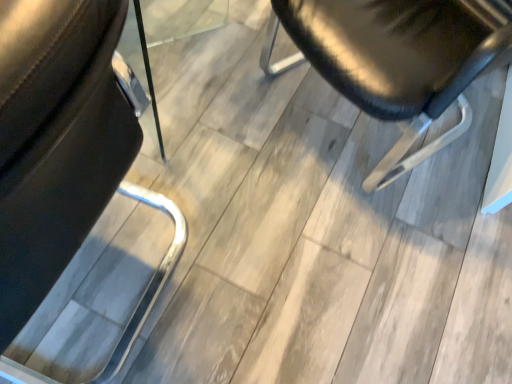
Question: Which direction should I rotate to look at shiny black chair at center, which appears as the first chair when viewed from the right?

Choices:
 (A) right
 (B) left

Answer: (A)

Question: Is black leather chair at left, placed as the 1th chair when sorted from left to right, aimed at shiny black chair at center, which is counted as the second chair, starting from the left?

Choices:
 (A) yes
 (B) no

Answer: (B)

Question: From a real-world perspective, does black leather chair at left, arranged as the second chair when viewed from the right, sit lower than shiny black chair at center, which is counted as the second chair, starting from the left?

Choices:
 (A) no
 (B) yes

Answer: (A)

Question: Does black leather chair at left, arranged as the second chair when viewed from the right, lie in front of shiny black chair at center, which appears as the first chair when viewed from the right?

Choices:
 (A) no
 (B) yes

Answer: (B)

Question: Does black leather chair at left, placed as the 1th chair when sorted from left to right, have a lesser width compared to shiny black chair at center, which appears as the first chair when viewed from the right?

Choices:
 (A) yes
 (B) no

Answer: (A)

Question: Considering the relative sizes of black leather chair at left, placed as the 1th chair when sorted from left to right, and shiny black chair at center, which is counted as the second chair, starting from the left, in the image provided, is black leather chair at left, placed as the 1th chair when sorted from left to right, bigger than shiny black chair at center, which is counted as the second chair, starting from the left,?

Choices:
 (A) no
 (B) yes

Answer: (B)

Question: From the image's perspective, is black leather chair at left, arranged as the second chair when viewed from the right, beneath shiny black chair at center, which is counted as the second chair, starting from the left?

Choices:
 (A) yes
 (B) no

Answer: (A)

Question: Considering the relative sizes of shiny black chair at center, which appears as the first chair when viewed from the right, and black leather chair at left, placed as the 1th chair when sorted from left to right, in the image provided, is shiny black chair at center, which appears as the first chair when viewed from the right, smaller than black leather chair at left, placed as the 1th chair when sorted from left to right,?

Choices:
 (A) yes
 (B) no

Answer: (A)

Question: From the image's perspective, is shiny black chair at center, which appears as the first chair when viewed from the right, below black leather chair at left, arranged as the second chair when viewed from the right?

Choices:
 (A) no
 (B) yes

Answer: (A)

Question: Is shiny black chair at center, which is counted as the second chair, starting from the left, wider than black leather chair at left, placed as the 1th chair when sorted from left to right?

Choices:
 (A) no
 (B) yes

Answer: (B)

Question: From a real-world perspective, is shiny black chair at center, which appears as the first chair when viewed from the right, over black leather chair at left, arranged as the second chair when viewed from the right?

Choices:
 (A) no
 (B) yes

Answer: (A)

Question: Is shiny black chair at center, which appears as the first chair when viewed from the right, at the left side of black leather chair at left, placed as the 1th chair when sorted from left to right?

Choices:
 (A) yes
 (B) no

Answer: (B)

Question: From the image's perspective, would you say shiny black chair at center, which appears as the first chair when viewed from the right, is positioned over black leather chair at left, arranged as the second chair when viewed from the right?

Choices:
 (A) yes
 (B) no

Answer: (A)

Question: Does point (96, 192) appear closer or farther from the camera than point (445, 81)?

Choices:
 (A) farther
 (B) closer

Answer: (B)